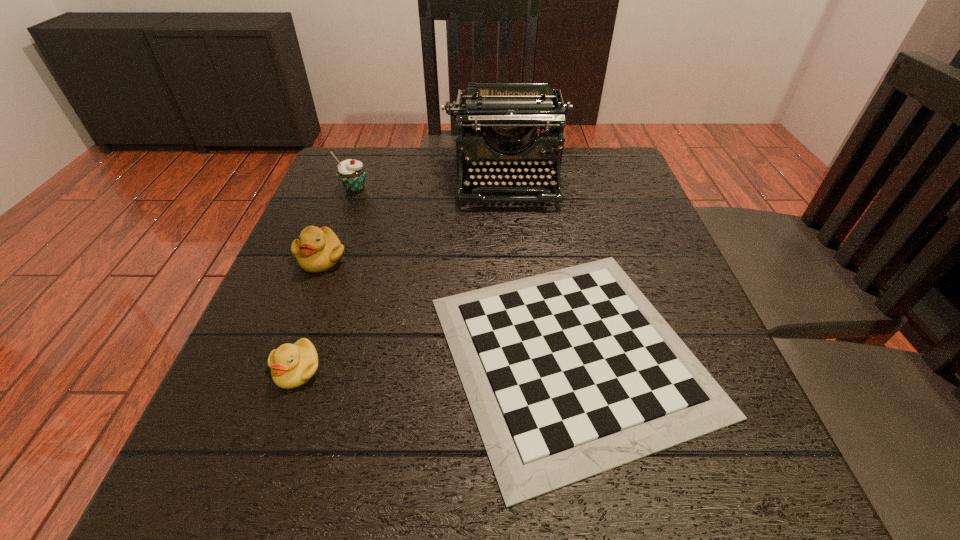
Identify the location of the tallest object. (507, 115).

What are the coordinates of `cupcake` in the screenshot? It's located at [352, 173].

Identify the location of the third tallest object. This screenshot has width=960, height=540. (318, 249).

The width and height of the screenshot is (960, 540). I want to click on the taller duckling, so click(318, 249).

This screenshot has height=540, width=960. I want to click on the fourth tallest object, so click(292, 365).

What are the coordinates of `the nearer duckling` in the screenshot? It's located at (292, 365).

Find the location of `the shortest object`. the shortest object is located at coordinates (570, 373).

Find the location of a particular element. This screenshot has height=540, width=960. vacant position located on the typing side of the tallest object is located at coordinates (516, 282).

Locate an element on the screen. The width and height of the screenshot is (960, 540). vacant space positioned 0.310m on the front of the second tallest object is located at coordinates tap(317, 292).

I want to click on vacant area situated 0.190m on the front-facing side of the third tallest object, so click(x=282, y=359).